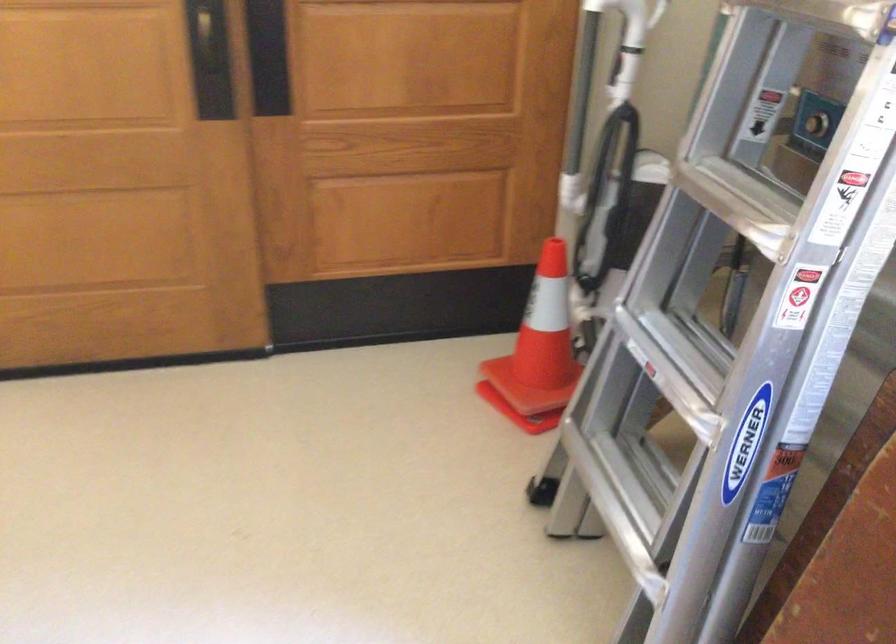
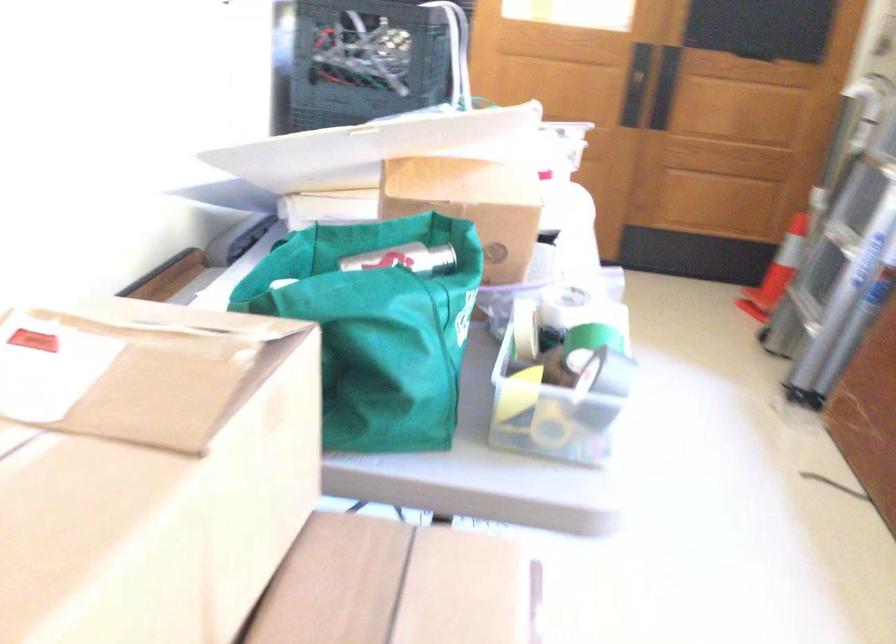
Find the pixel in the second image that matches the point at 192,73 in the first image.

(639, 87)